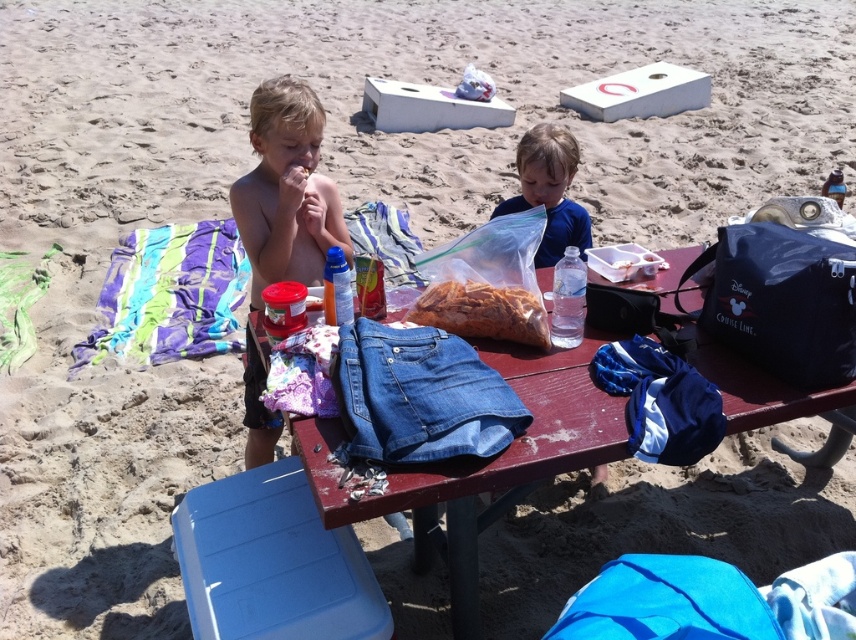
Looking at this image, who is taller, blue matte shirt at center or translucent plastic bag of nuts at center?

blue matte shirt at center is taller.

Is blue matte shirt at center further to the viewer compared to translucent plastic bag of nuts at center?

Yes, it is behind translucent plastic bag of nuts at center.

Who is more forward, (547, 230) or (522, 301)?

Positioned in front is point (522, 301).

Where is `blue matte shirt at center`? blue matte shirt at center is located at coordinates (550, 189).

Is multicolored striped towel at left below translucent plastic bag of nuts at center?

Incorrect, multicolored striped towel at left is not positioned below translucent plastic bag of nuts at center.

Is multicolored striped towel at left closer to camera compared to translucent plastic bag of nuts at center?

No, multicolored striped towel at left is behind translucent plastic bag of nuts at center.

Is point (211, 257) farther from camera compared to point (541, 337)?

Yes, it is.

This screenshot has height=640, width=856. I want to click on multicolored striped towel at left, so click(x=169, y=296).

Between wooden picnic table at center and multicolored striped towel at left, which one appears on the right side from the viewer's perspective?

Positioned to the right is wooden picnic table at center.

Does wooden picnic table at center appear on the right side of multicolored striped towel at left?

Correct, you'll find wooden picnic table at center to the right of multicolored striped towel at left.

Is point (798, 408) closer to camera compared to point (179, 310)?

Yes, it is in front of point (179, 310).

At what (x,y) coordinates should I click in order to perform the action: click on wooden picnic table at center. Please return your answer as a coordinate pair (x, y). This screenshot has height=640, width=856. Looking at the image, I should click on (479, 464).